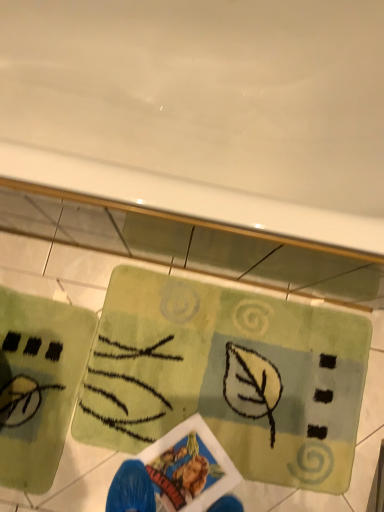
Question: From a real-world perspective, is green soft yoga mat at lower left, arranged as the second yoga mat when viewed from the right, physically located above or below green textured rug at center, which ranks as the first yoga mat in right-to-left order?

Choices:
 (A) above
 (B) below

Answer: (A)

Question: Choose the correct answer: Is green soft yoga mat at lower left, arranged as the second yoga mat when viewed from the right, inside green textured rug at center, which ranks as the first yoga mat in right-to-left order, or outside it?

Choices:
 (A) outside
 (B) inside

Answer: (A)

Question: Looking at their shapes, would you say green soft yoga mat at lower left, arranged as the second yoga mat when viewed from the right, is wider or thinner than green textured rug at center, the second yoga mat in the left-to-right sequence?

Choices:
 (A) thin
 (B) wide

Answer: (A)

Question: From the image's perspective, is green textured rug at center, which ranks as the first yoga mat in right-to-left order, above or below green soft yoga mat at lower left, the first yoga mat from the left?

Choices:
 (A) above
 (B) below

Answer: (A)

Question: Is green textured rug at center, which ranks as the first yoga mat in right-to-left order, taller or shorter than green soft yoga mat at lower left, the first yoga mat from the left?

Choices:
 (A) tall
 (B) short

Answer: (B)

Question: Looking at their shapes, would you say green textured rug at center, which ranks as the first yoga mat in right-to-left order, is wider or thinner than green soft yoga mat at lower left, arranged as the second yoga mat when viewed from the right?

Choices:
 (A) thin
 (B) wide

Answer: (B)

Question: Considering their positions, is green textured rug at center, which ranks as the first yoga mat in right-to-left order, located in front of or behind green soft yoga mat at lower left, arranged as the second yoga mat when viewed from the right?

Choices:
 (A) behind
 (B) front

Answer: (A)